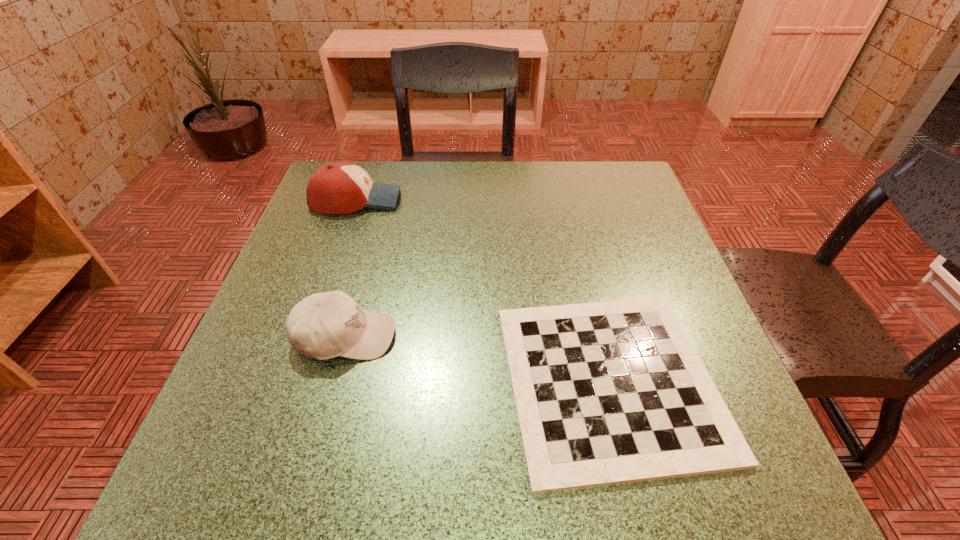
Image resolution: width=960 pixels, height=540 pixels. In order to click on vacant space that is in between the farthest object and the nearer baseball cap in this screenshot , I will do `click(350, 268)`.

Where is `free spot between the farthest object and the shortest object`? Image resolution: width=960 pixels, height=540 pixels. free spot between the farthest object and the shortest object is located at coordinates 483,290.

Locate an element on the screen. The image size is (960, 540). empty space between the nearer baseball cap and the shortest object is located at coordinates (477, 359).

In order to click on free space between the nearer baseball cap and the farther baseball cap in this screenshot , I will do click(x=350, y=268).

Where is `empty space that is in between the farther baseball cap and the checkerboard`? This screenshot has height=540, width=960. empty space that is in between the farther baseball cap and the checkerboard is located at coordinates click(x=483, y=290).

In order to click on free area in between the farther baseball cap and the nearer baseball cap in this screenshot , I will do `click(350, 268)`.

Identify the location of free point between the nearer baseball cap and the checkerboard. (477, 359).

You are a GUI agent. You are given a task and a screenshot of the screen. Output one action in this format:
    pyautogui.click(x=<x>, y=<y>)
    Task: Click on the free space between the farthest object and the nearer baseball cap
    
    Given the screenshot: What is the action you would take?
    pyautogui.click(x=350, y=268)

Identify which object is the second nearest to the nearer baseball cap. Please provide its 2D coordinates. Your answer should be formatted as a tuple, i.e. [(x, y)], where the tuple contains the x and y coordinates of a point satisfying the conditions above.

[(340, 187)]

Where is `object that stands as the second closest to the checkerboard`? The image size is (960, 540). object that stands as the second closest to the checkerboard is located at coordinates (340, 187).